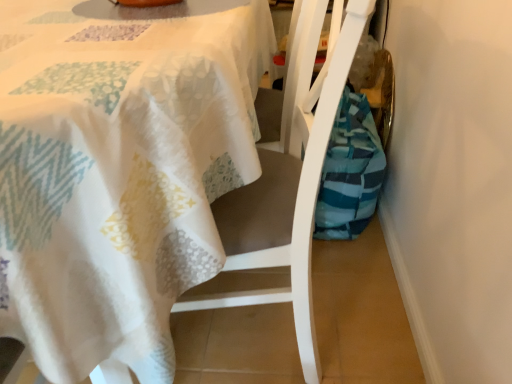
Question: From a real-world perspective, is teal striped fabric bag at lower right above or below white textured tablecloth at upper left?

Choices:
 (A) below
 (B) above

Answer: (A)

Question: Looking at their shapes, would you say teal striped fabric bag at lower right is wider or thinner than white textured tablecloth at upper left?

Choices:
 (A) wide
 (B) thin

Answer: (B)

Question: Which of these objects is positioned closest to the white fabric chair at center?

Choices:
 (A) white textured tablecloth at upper left
 (B) teal striped fabric bag at lower right

Answer: (A)

Question: Based on their relative distances, which object is nearer to the white fabric chair at center?

Choices:
 (A) white textured tablecloth at upper left
 (B) teal striped fabric bag at lower right

Answer: (A)